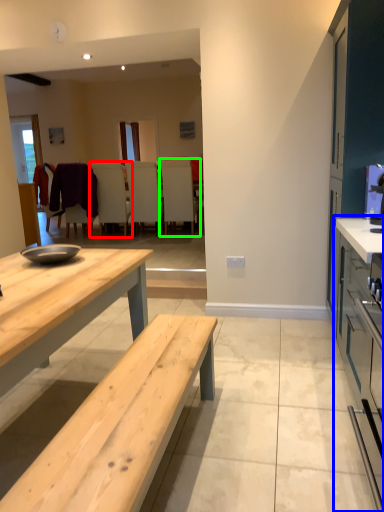
Question: Which object is the closest to the chair (highlighted by a red box)? Choose among these: cabinetry (highlighted by a blue box) or chair (highlighted by a green box).

Choices:
 (A) cabinetry
 (B) chair

Answer: (B)